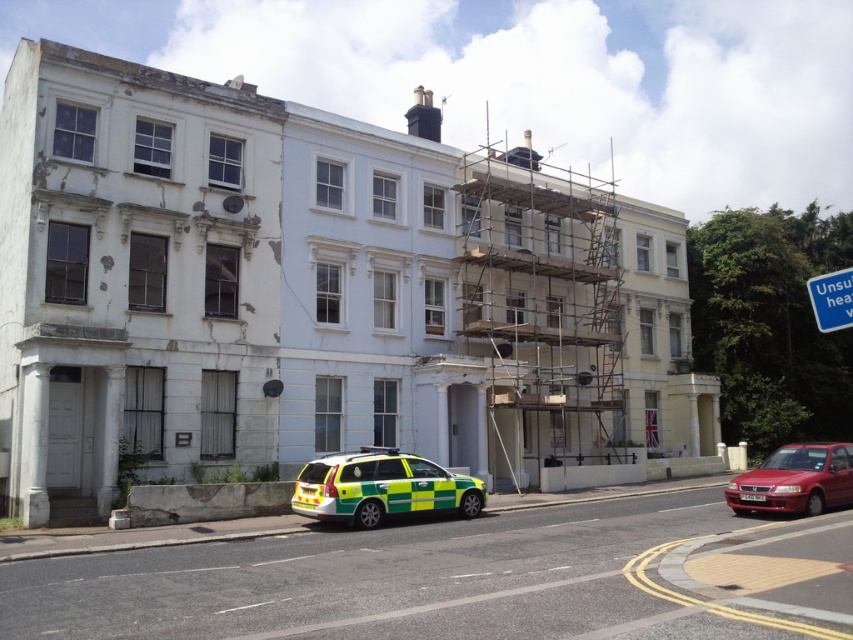
You are standing in front of the building and want to park your car, which is 4 meters long, in the space where the metallic red sedan at lower right is currently parked. Can your car fit in that space?

The metallic red sedan at lower right is 16.64 meters away from the viewer, but the question is about the length of the parking space, not the distance. Since the description only provides the distance between the car and viewer, there is insufficient information to determine if your 4 meter car can fit in the space.